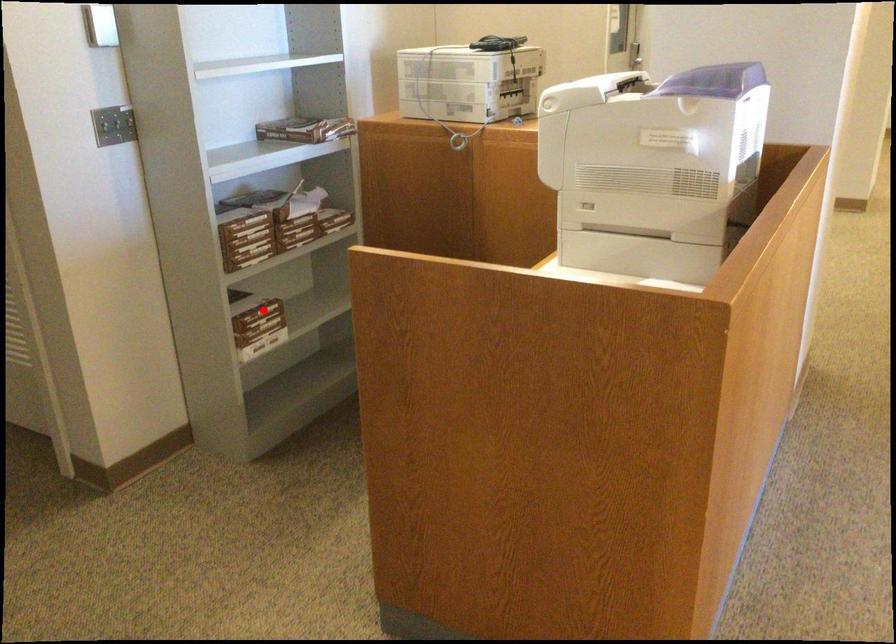
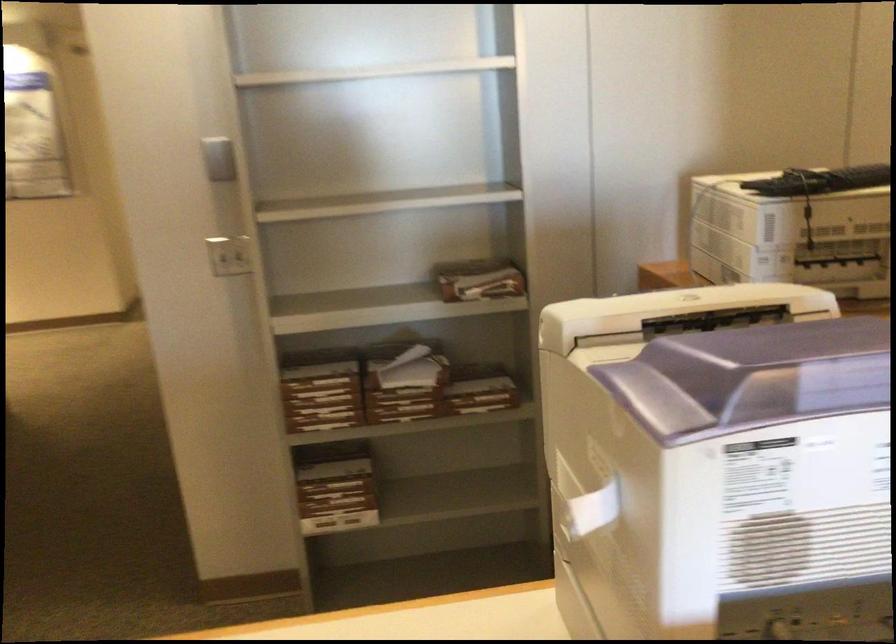
Question: I am providing you with two images of the same scene from different viewpoints. A red point is marked on the first image. Is the red point's position out of view in image 2?

Choices:
 (A) Yes
 (B) No

Answer: (B)